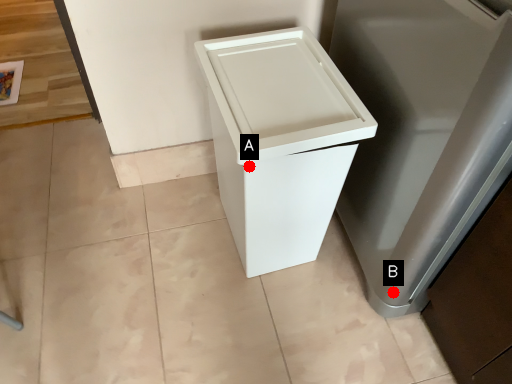
Question: Two points are circled on the image, labeled by A and B beside each circle. Among these points, which one is farthest from the camera?

Choices:
 (A) A is further
 (B) B is further

Answer: (B)